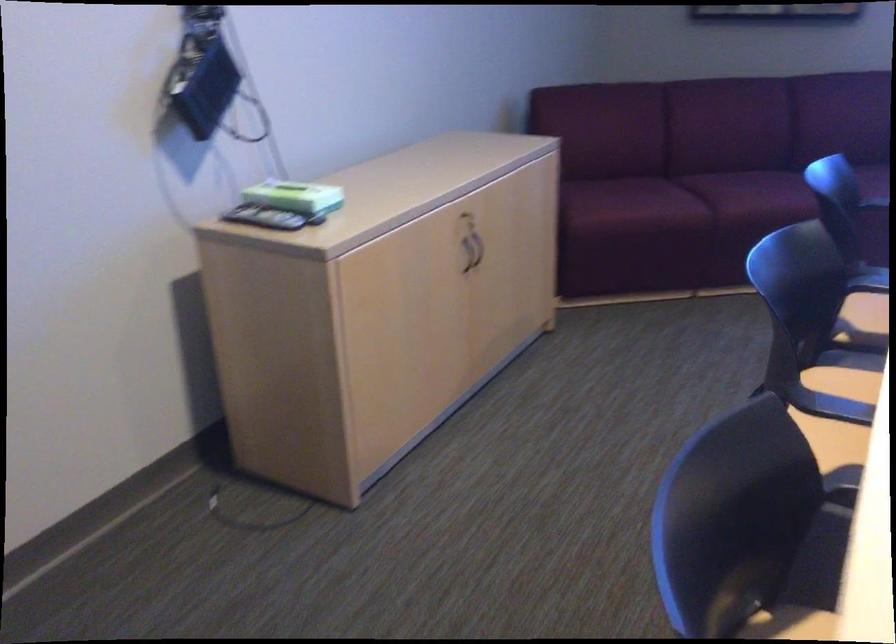
Where is `cabinet lid`? The image size is (896, 644). cabinet lid is located at coordinates (428, 175).